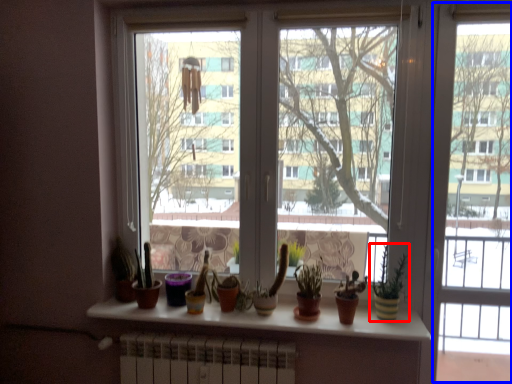
Question: Which object appears closest to the camera in this image, houseplant (highlighted by a red box) or screen door (highlighted by a blue box)?

Choices:
 (A) houseplant
 (B) screen door

Answer: (B)